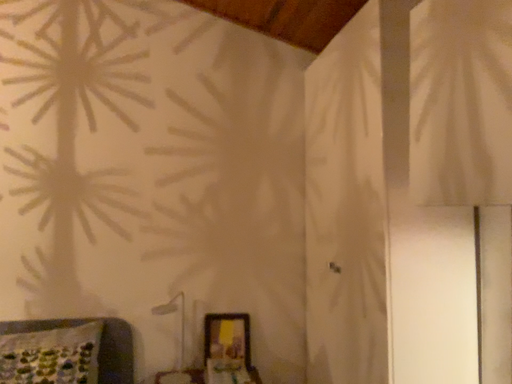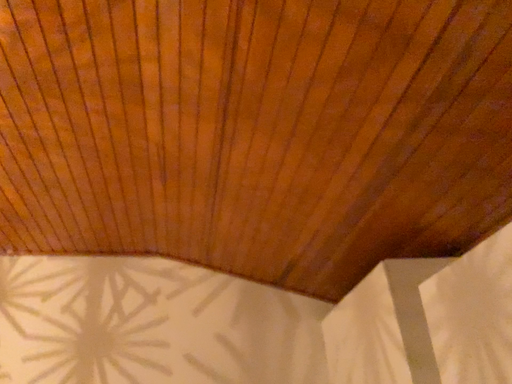
Question: Which way did the camera rotate in the video?

Choices:
 (A) rotated downward
 (B) rotated upward

Answer: (B)